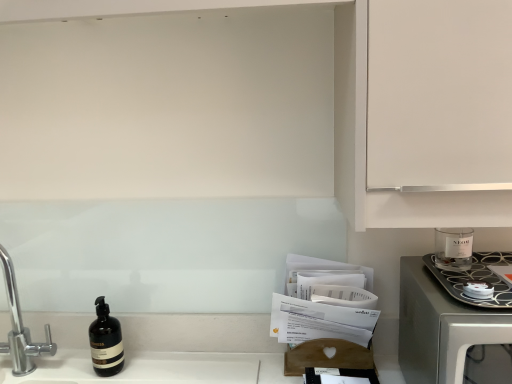
This screenshot has height=384, width=512. What are the coordinates of `vacant space underneath clear glass candle at right (from a real-world perspective)` in the screenshot? It's located at (473, 270).